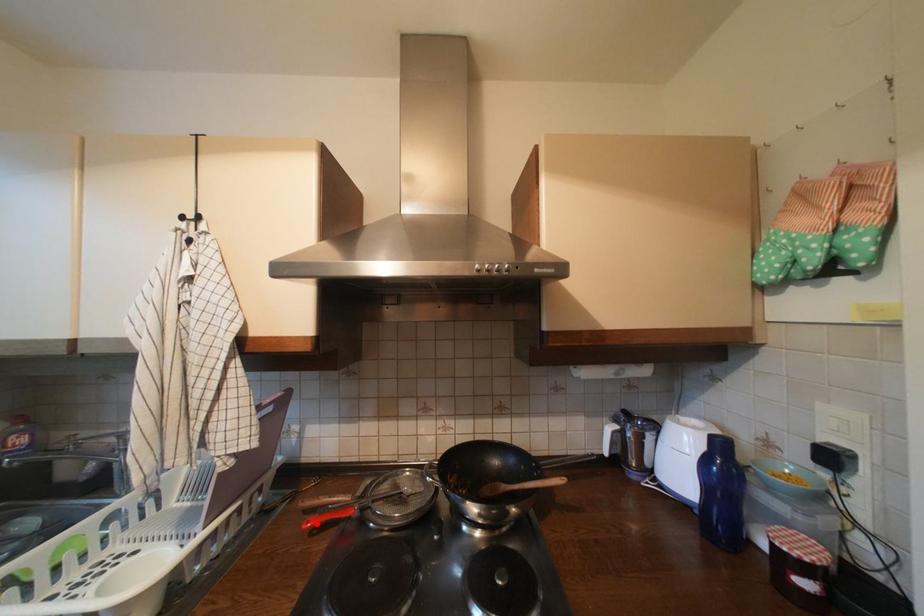
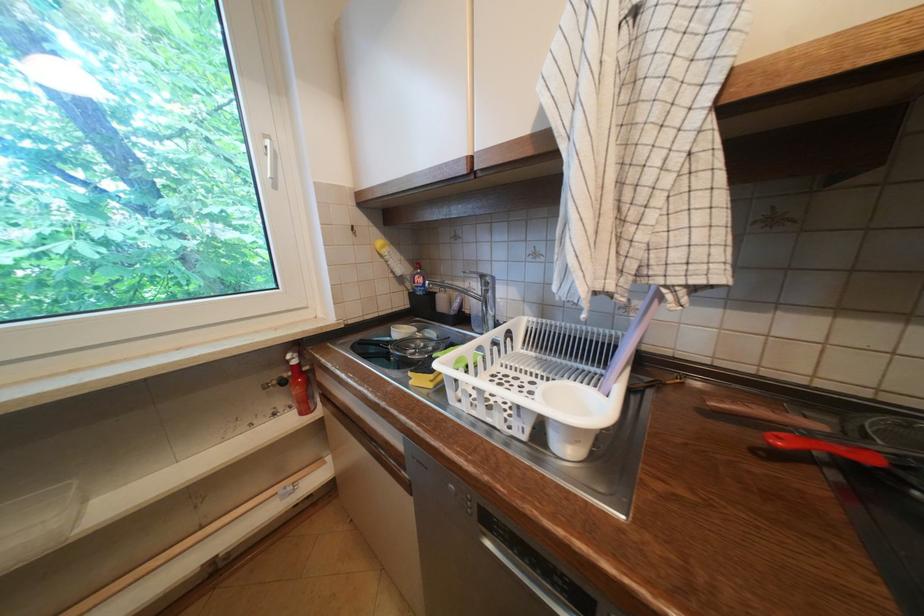
Locate, in the second image, the point that corresponds to the highlighted location in the first image.

(788, 440)